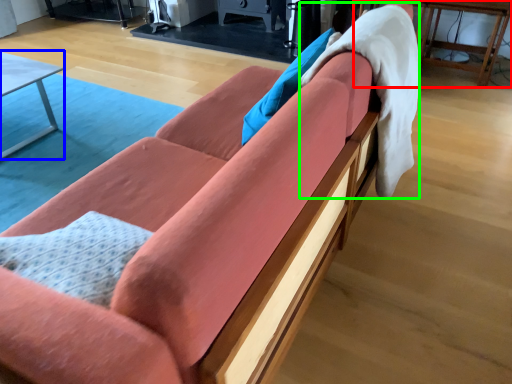
Question: Which object is the farthest from table (highlighted by a red box)? Choose among these: table (highlighted by a blue box) or blanket (highlighted by a green box).

Choices:
 (A) table
 (B) blanket

Answer: (A)